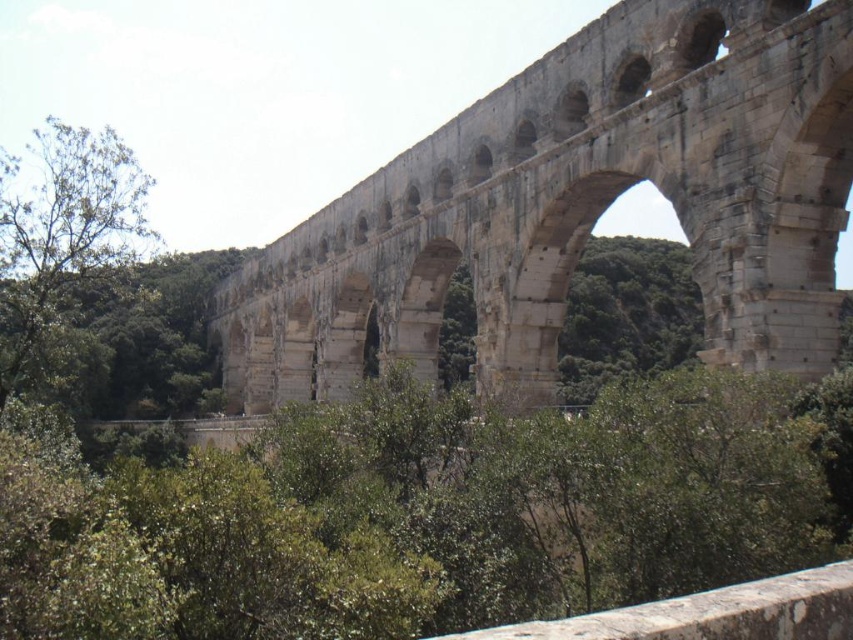
You are a drone operator tasked with capturing aerial footage of the stone arch bridge at center. The drone must maintain a safe distance of at least 5 meters from the bridge to avoid damage. Given the bridge is at coordinates point 0.323, 0.679, can you confirm if the drone can safely hover at coordinates point 0.4, 0.7 without violating the safety distance?

The stone arch bridge at center is located at point (578, 205). The distance between the drone at point (596, 256) and the bridge can be calculated using the Euclidean distance formula. The horizontal distance is 0.4 minus 0.323 equals 0.077, and the vertical distance is 0.7 minus 0.679 equals 0.021. Squaring both distances gives 0.0059 and 0.0004, summing to 0.0063. The square root of that is approximately 0.079 meters. Since this is less than the required 5 meters, the drone cannot safely hover at point 0

You are standing at the green leafy tree at left and want to cross the river using the stone arch bridge at center. Which direction should you face to walk towards the bridge?

You should face to the right to walk towards the stone arch bridge at center since it is located to the right of the green leafy tree at left.